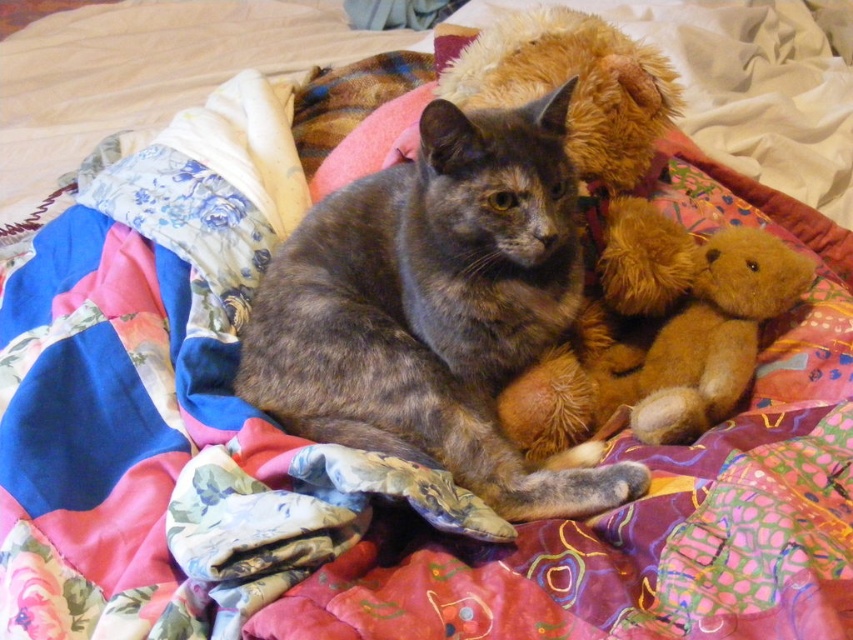
You are a photographer setting up a shot of the gray fur cat at center and the fuzzy brown teddy bear at upper right. To ensure both subjects are in frame, where should you position your camera relative to the bed?

The gray fur cat at center is positioned on the left side of the fuzzy brown teddy bear at upper right, so you should position your camera to the left of the bed to capture both subjects in the frame.

You are a photographer trying to capture a photo of the gray fur cat at center and the fuzzy brown teddy bear at upper right. If you want to ensure both subjects are in focus, which one should you focus on first, the one closer to you or the one farther away?

Since the gray fur cat at center is much taller than the fuzzy brown teddy bear at upper right, it is likely closer to the camera. To ensure both are in focus, you should focus on the gray fur cat at center first as it is closer, and the depth of field will extend to the teddy bear at upper right.

You are a photographer setting up a camera to capture the gray fur cat at center and the fuzzy brown teddy bear at upper right. You need to ensure that both subjects are in frame. Given that the camera has a fixed width, which subject requires more horizontal space to fully capture?

The gray fur cat at center requires more horizontal space because its width surpasses that of the fuzzy brown teddy bear at upper right.